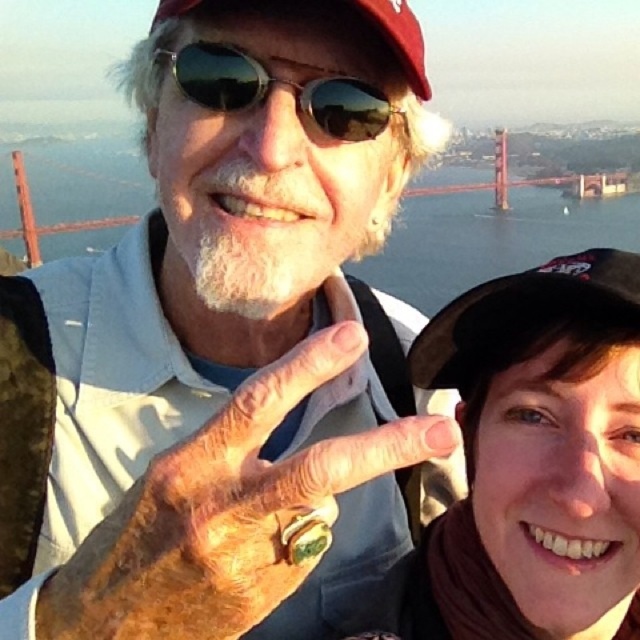
Looking at this image, does matte black vest at center appear under green stone ring at center?

No.

Can you confirm if matte black vest at center is bigger than green stone ring at center?

Yes.

Is point (38, 481) closer to viewer compared to point (205, 513)?

No.

At what (x,y) coordinates should I click in order to perform the action: click on matte black vest at center. Please return your answer as a coordinate pair (x, y). Looking at the image, I should click on (228, 348).

The width and height of the screenshot is (640, 640). What do you see at coordinates (524, 310) in the screenshot?
I see `black fabric baseball cap at right` at bounding box center [524, 310].

Is black fabric baseball cap at right above sunglasses at center?

Incorrect, black fabric baseball cap at right is not positioned above sunglasses at center.

I want to click on black fabric baseball cap at right, so click(x=524, y=310).

The width and height of the screenshot is (640, 640). I want to click on black fabric baseball cap at right, so click(x=524, y=310).

Can you confirm if sunglasses at center is positioned to the left of red painted steel bridge at upper right?

Indeed, sunglasses at center is positioned on the left side of red painted steel bridge at upper right.

Is sunglasses at center below red painted steel bridge at upper right?

Indeed, sunglasses at center is positioned under red painted steel bridge at upper right.

Image resolution: width=640 pixels, height=640 pixels. I want to click on sunglasses at center, so click(282, 83).